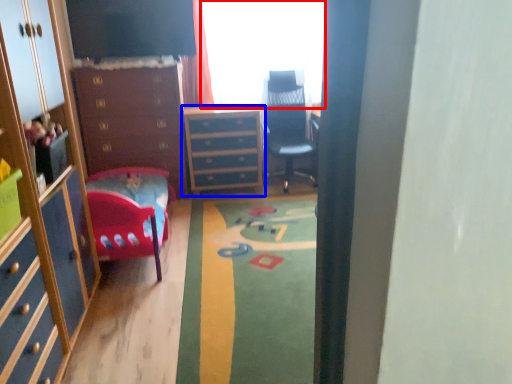
Question: Which of the following is the farthest to the observer, window (highlighted by a red box) or chest of drawers (highlighted by a blue box)?

Choices:
 (A) window
 (B) chest of drawers

Answer: (B)